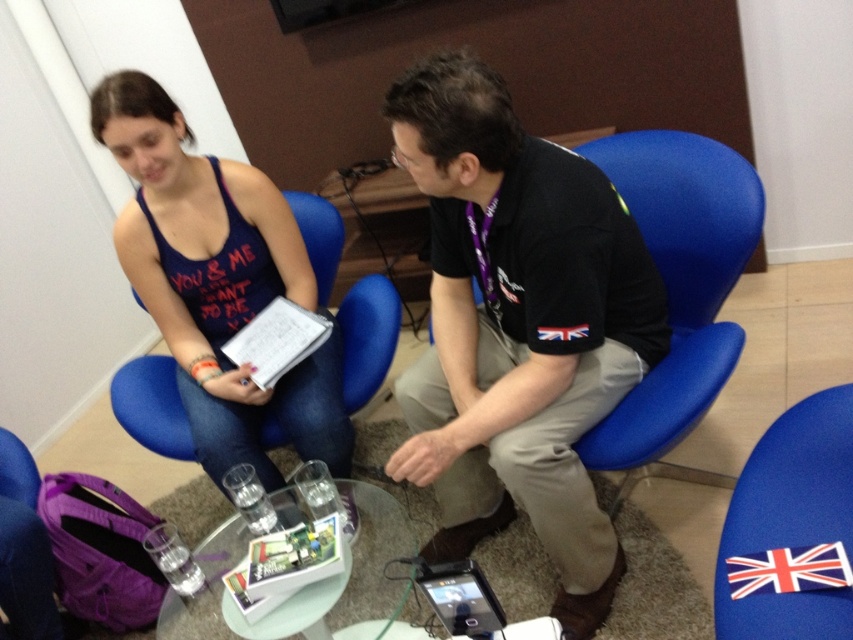
Question: Which point is farther to the camera?

Choices:
 (A) blue fabric chair at center
 (B) transparent glass table at center
 (C) black cotton shirt at center

Answer: (A)

Question: Is black cotton shirt at center further to the viewer compared to matte black tank top at upper left?

Choices:
 (A) no
 (B) yes

Answer: (A)

Question: Which object is positioned closest to the black cotton shirt at center?

Choices:
 (A) blue fabric chair at center
 (B) blue fabric chair at lower right
 (C) matte black tank top at upper left

Answer: (A)

Question: Among these points, which one is farthest from the camera?

Choices:
 (A) tap(219, 579)
 (B) tap(680, 154)

Answer: (B)

Question: Is blue fabric chair at center to the right of purple fabric chair at lower left from the viewer's perspective?

Choices:
 (A) yes
 (B) no

Answer: (A)

Question: Is blue fabric chair at center to the left of purple fabric chair at lower left from the viewer's perspective?

Choices:
 (A) yes
 (B) no

Answer: (B)